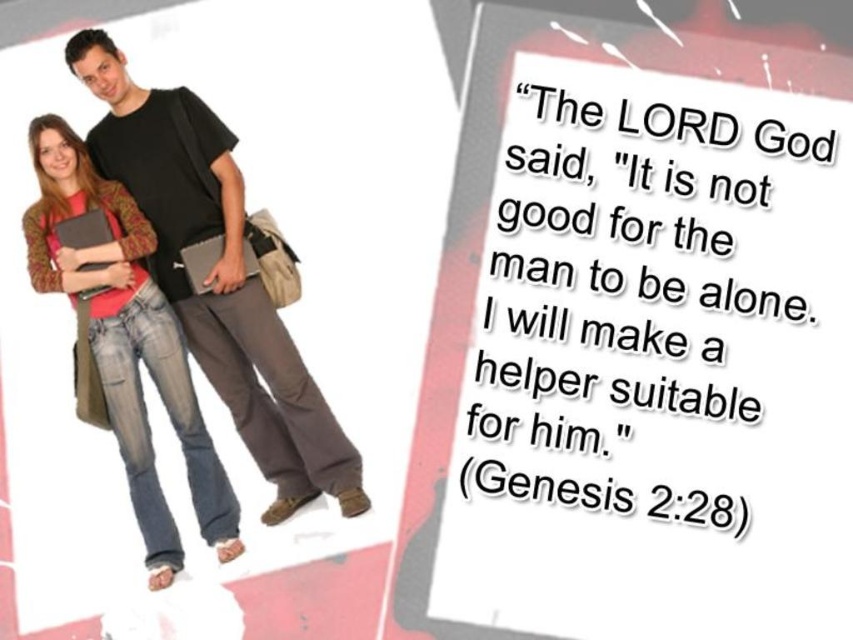
Question: Does black matte t-shirt at center lie behind denim jeans at left?

Choices:
 (A) yes
 (B) no

Answer: (A)

Question: Can you confirm if black matte t-shirt at center is positioned to the right of denim jeans at left?

Choices:
 (A) no
 (B) yes

Answer: (B)

Question: Which object is closer to the camera taking this photo?

Choices:
 (A) black matte t-shirt at center
 (B) denim jeans at left

Answer: (B)

Question: Which object is farther from the camera taking this photo?

Choices:
 (A) black matte t-shirt at center
 (B) denim jeans at left

Answer: (A)

Question: Is black matte t-shirt at center in front of denim jeans at left?

Choices:
 (A) no
 (B) yes

Answer: (A)